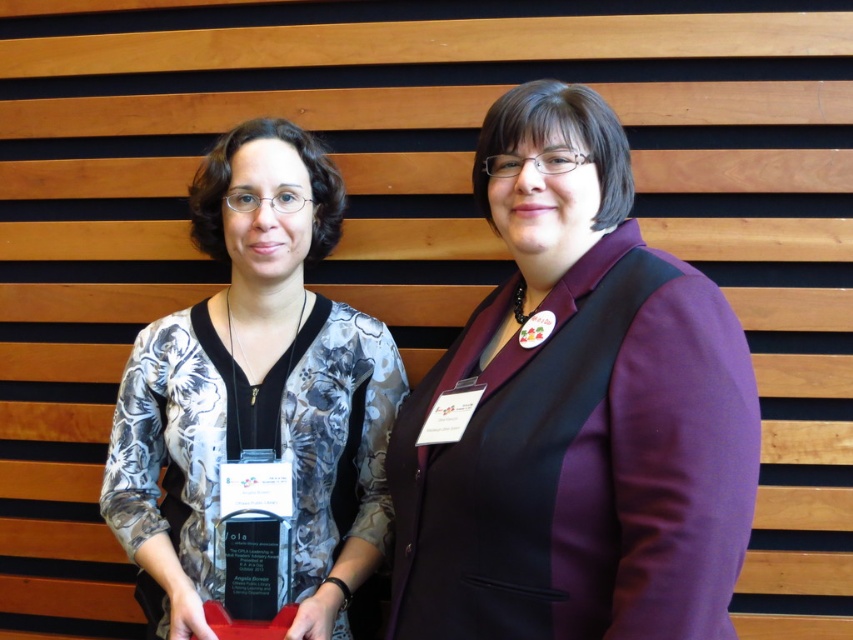
Question: Which point is closer to the camera?

Choices:
 (A) printed fabric blouse at center
 (B) purple matte blazer at center

Answer: (B)

Question: Is purple matte blazer at center positioned before printed fabric blouse at center?

Choices:
 (A) no
 (B) yes

Answer: (B)

Question: Can you confirm if purple matte blazer at center is positioned to the left of printed fabric blouse at center?

Choices:
 (A) yes
 (B) no

Answer: (B)

Question: Which of the following is the closest to the observer?

Choices:
 (A) (225, 332)
 (B) (550, 442)

Answer: (B)

Question: Does purple matte blazer at center have a smaller size compared to printed fabric blouse at center?

Choices:
 (A) yes
 (B) no

Answer: (A)